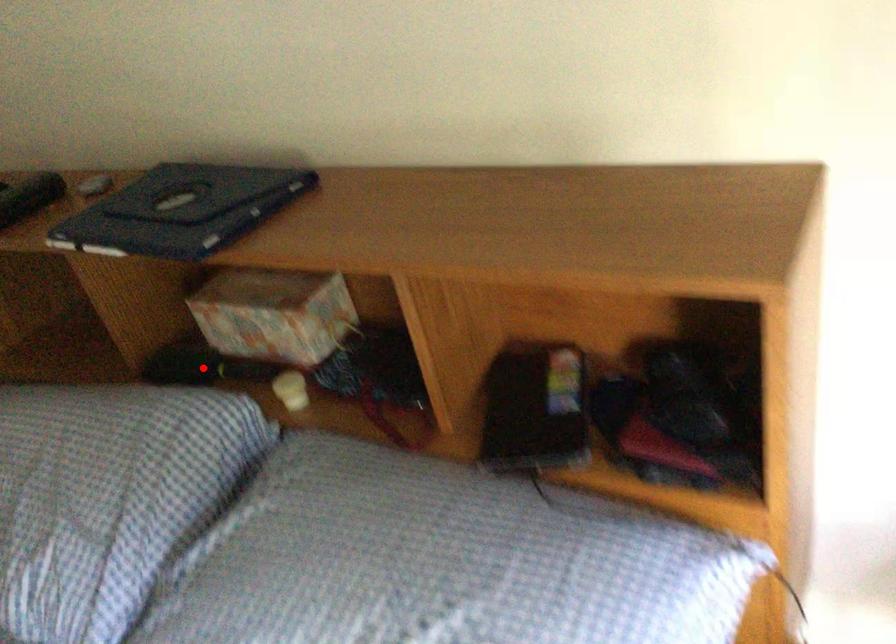
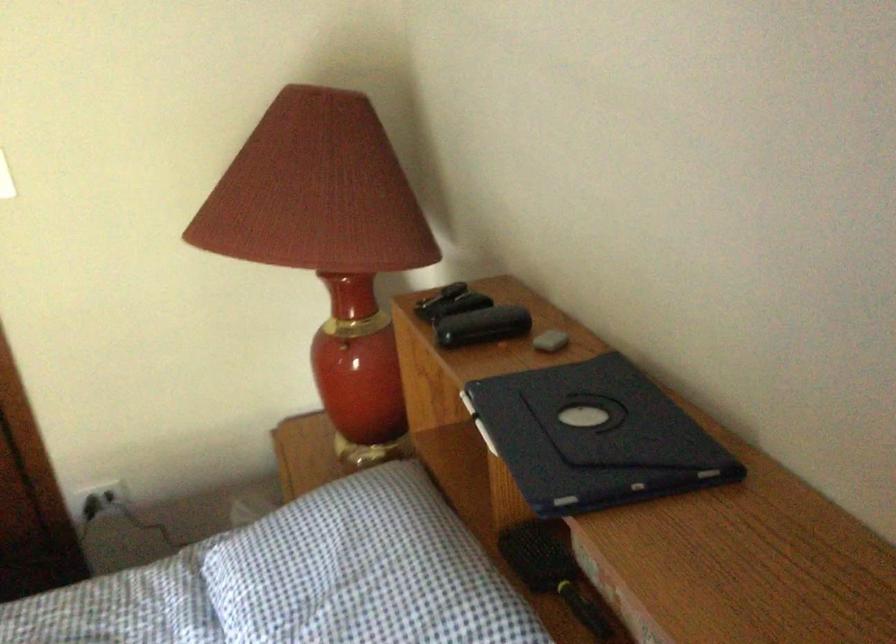
Question: I am providing you with two images of the same scene from different viewpoints. Image1 has a red point marked. In image2, the corresponding 3D location appears at what relative position? Reply with the corresponding letter.

Choices:
 (A) Closer
 (B) Farther

Answer: (A)